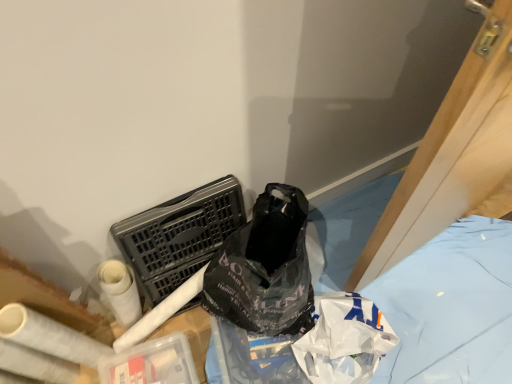
Question: Is white matte toilet paper at lower left wider or thinner than black plastic bag at lower right?

Choices:
 (A) thin
 (B) wide

Answer: (A)

Question: From the image's perspective, is white matte toilet paper at lower left positioned above or below black plastic bag at lower right?

Choices:
 (A) above
 (B) below

Answer: (A)

Question: Considering the real-world distances, which object is closest to the black plastic laundry basket at center-left?

Choices:
 (A) white matte toilet paper at lower left
 (B) black plastic bag at lower right

Answer: (A)

Question: Which is farther from the black plastic bag at lower right?

Choices:
 (A) black plastic laundry basket at center-left
 (B) white matte toilet paper at lower left

Answer: (B)